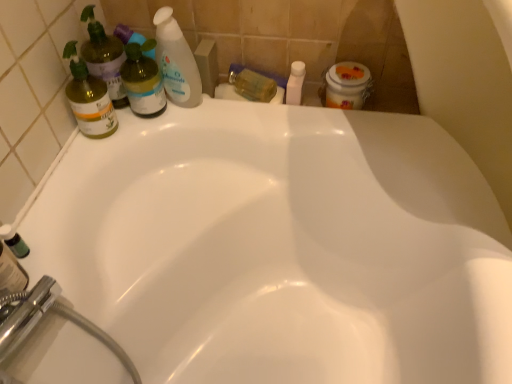
Where is `white plastic bottle at upper center, the second toiletry in the left-to-right sequence`? The width and height of the screenshot is (512, 384). white plastic bottle at upper center, the second toiletry in the left-to-right sequence is located at coordinates (295, 83).

How much space does white plastic bottle at upper center, acting as the 1th toiletry starting from the right, occupy vertically?

6.45 centimeters.

The image size is (512, 384). Identify the location of translucent yellow bottle at upper center, the second toiletry from the right. (252, 84).

Find the location of a particular element. matte green bottle at left, the 2th cleaning product from the left is located at coordinates (104, 57).

Based on the photo, is white plastic bottle at upper center, acting as the 1th toiletry starting from the right, not close to translucent yellow bottle at upper center, which appears as the first toiletry when viewed from the left?

white plastic bottle at upper center, acting as the 1th toiletry starting from the right, is near translucent yellow bottle at upper center, which appears as the first toiletry when viewed from the left, not far away.

Does point (291, 65) appear closer or farther from the camera than point (239, 68)?

Point (291, 65) is positioned closer to the camera compared to point (239, 68).

The width and height of the screenshot is (512, 384). What are the coordinates of `toiletry below the translucent yellow bottle at upper center, which appears as the first toiletry when viewed from the left (from the image's perspective)` in the screenshot? It's located at (295, 83).

Consider the image. Can you confirm if white plastic bottle at upper center, acting as the 1th toiletry starting from the right, is bigger than translucent yellow bottle at upper center, which appears as the first toiletry when viewed from the left?

Incorrect, white plastic bottle at upper center, acting as the 1th toiletry starting from the right, is not larger than translucent yellow bottle at upper center, which appears as the first toiletry when viewed from the left.

Consider the image. Is green matte bottle at lower left positioned with its back to matte green bottle at left, the 2th cleaning product from the left?

No, green matte bottle at lower left's orientation is not away from matte green bottle at left, the 2th cleaning product from the left.

Based on the photo, is green matte bottle at lower left wider or thinner than matte green bottle at left, which is counted as the 2th cleaning product, starting from the right?

Considering their sizes, green matte bottle at lower left looks slimmer than matte green bottle at left, which is counted as the 2th cleaning product, starting from the right.

Image resolution: width=512 pixels, height=384 pixels. I want to click on mouthwash below the matte green bottle at left, which is counted as the 2th cleaning product, starting from the right (from a real-world perspective), so click(x=14, y=241).

Who is shorter, green matte bottle at lower left or matte green bottle at left, which is counted as the 2th cleaning product, starting from the right?

Standing shorter between the two is green matte bottle at lower left.

Could translucent plastic bottle at upper left, placed as the third cleaning product when sorted from left to right, be considered to be inside translucent yellow bottle at upper center, which appears as the first toiletry when viewed from the left?

No, translucent plastic bottle at upper left, placed as the third cleaning product when sorted from left to right, is located outside of translucent yellow bottle at upper center, which appears as the first toiletry when viewed from the left.

Between translucent yellow bottle at upper center, which appears as the first toiletry when viewed from the left, and translucent plastic bottle at upper left, placed as the third cleaning product when sorted from left to right, which one has larger size?

With larger size is translucent plastic bottle at upper left, placed as the third cleaning product when sorted from left to right.

Is translucent yellow bottle at upper center, the second toiletry from the right, facing away from translucent plastic bottle at upper left, placed as the third cleaning product when sorted from left to right?

No, translucent yellow bottle at upper center, the second toiletry from the right, is not facing away from translucent plastic bottle at upper left, placed as the third cleaning product when sorted from left to right.

Would you say white plastic bottle at upper center, acting as the 1th toiletry starting from the right, is part of translucent yellow bottle at upper center, which appears as the first toiletry when viewed from the left,'s contents?

Actually, white plastic bottle at upper center, acting as the 1th toiletry starting from the right, is outside translucent yellow bottle at upper center, which appears as the first toiletry when viewed from the left.

From the image's perspective, is translucent yellow bottle at upper center, which appears as the first toiletry when viewed from the left, located above or below white plastic bottle at upper center, the second toiletry in the left-to-right sequence?

Based on their image positions, translucent yellow bottle at upper center, which appears as the first toiletry when viewed from the left, is located above white plastic bottle at upper center, the second toiletry in the left-to-right sequence.

Between translucent yellow bottle at upper center, the second toiletry from the right, and white plastic bottle at upper center, acting as the 1th toiletry starting from the right, which one is positioned in front?

white plastic bottle at upper center, acting as the 1th toiletry starting from the right, is closer to the camera.

Between point (242, 84) and point (292, 102), which one is positioned behind?

The point (242, 84) is more distant.

Locate an element on the screen. The width and height of the screenshot is (512, 384). cleaning product that is the 3rd object located in front of the translucent yellow bottle at upper center, which appears as the first toiletry when viewed from the left is located at coordinates (89, 98).

Could you tell me if translucent yellow bottle at upper center, which appears as the first toiletry when viewed from the left, is facing green glass spray bottle at left, the 3th cleaning product from the right?

No.

Choose the correct answer: Is translucent yellow bottle at upper center, which appears as the first toiletry when viewed from the left, inside green glass spray bottle at left, the first cleaning product positioned from the left, or outside it?

translucent yellow bottle at upper center, which appears as the first toiletry when viewed from the left, is located beyond the bounds of green glass spray bottle at left, the first cleaning product positioned from the left.

Is translucent plastic bottle at upper left, the 1th cleaning product positioned from the right, far away from white plastic bottle at upper center, the second toiletry in the left-to-right sequence?

No, translucent plastic bottle at upper left, the 1th cleaning product positioned from the right, is not far from white plastic bottle at upper center, the second toiletry in the left-to-right sequence.

From a real-world perspective, is translucent plastic bottle at upper left, placed as the third cleaning product when sorted from left to right, beneath white plastic bottle at upper center, acting as the 1th toiletry starting from the right?

No, from a real-world perspective, translucent plastic bottle at upper left, placed as the third cleaning product when sorted from left to right, is not below white plastic bottle at upper center, acting as the 1th toiletry starting from the right.

Does point (174, 39) appear closer or farther from the camera than point (293, 84)?

Point (174, 39) is positioned closer to the camera compared to point (293, 84).

Is white plastic bottle at upper center, acting as the 1th toiletry starting from the right, situated inside green matte bottle at lower left or outside?

white plastic bottle at upper center, acting as the 1th toiletry starting from the right, lies outside green matte bottle at lower left.

Considering the points (304, 63) and (17, 243), which point is in front, point (304, 63) or point (17, 243)?

The point (17, 243) is in front.

Is white plastic bottle at upper center, the second toiletry in the left-to-right sequence, wider than green matte bottle at lower left?

Yes, white plastic bottle at upper center, the second toiletry in the left-to-right sequence, is wider than green matte bottle at lower left.

Who is bigger, white plastic bottle at upper center, the second toiletry in the left-to-right sequence, or green matte bottle at lower left?

With larger size is white plastic bottle at upper center, the second toiletry in the left-to-right sequence.

The image size is (512, 384). In order to click on toiletry above the translucent yellow bottle at upper center, the second toiletry from the right (from a real-world perspective) in this screenshot , I will do `click(295, 83)`.

This screenshot has height=384, width=512. I want to click on mouthwash below the matte green bottle at left, which is counted as the 2th cleaning product, starting from the right (from the image's perspective), so click(14, 241).

Looking at the image, which one is located closer to white plastic bottle at upper center, acting as the 1th toiletry starting from the right, green glass spray bottle at left, the 3th cleaning product from the right, or translucent plastic bottle at upper left, the 1th cleaning product positioned from the right?

translucent plastic bottle at upper left, the 1th cleaning product positioned from the right, lies closer to white plastic bottle at upper center, acting as the 1th toiletry starting from the right, than the other object.

Considering their positions, is green matte bottle at lower left positioned further to translucent yellow bottle at upper center, which appears as the first toiletry when viewed from the left, than white plastic bottle at upper center, the second toiletry in the left-to-right sequence?

Result: The object further to translucent yellow bottle at upper center, which appears as the first toiletry when viewed from the left, is green matte bottle at lower left.

Considering their positions, is white plastic bottle at upper center, the second toiletry in the left-to-right sequence, positioned further to matte green bottle at left, which is counted as the 2th cleaning product, starting from the right, than green glass spray bottle at left, the first cleaning product positioned from the left?

The object further to matte green bottle at left, which is counted as the 2th cleaning product, starting from the right, is white plastic bottle at upper center, the second toiletry in the left-to-right sequence.

From the image, which object appears to be farther from green glass spray bottle at left, the 3th cleaning product from the right, green matte bottle at lower left or matte green bottle at left, the 2th cleaning product from the left?

Among the two, green matte bottle at lower left is located further to green glass spray bottle at left, the 3th cleaning product from the right.

Which object lies further to the anchor point green matte bottle at lower left, green glass spray bottle at left, the 3th cleaning product from the right, or matte green bottle at left, the 2th cleaning product from the left?

The object further to green matte bottle at lower left is matte green bottle at left, the 2th cleaning product from the left.

From the image, which object appears to be nearer to green glass spray bottle at left, the 3th cleaning product from the right, matte green bottle at left, the 2th cleaning product from the left, or green matte bottle at lower left?

matte green bottle at left, the 2th cleaning product from the left, is positioned closer to the anchor green glass spray bottle at left, the 3th cleaning product from the right.

Estimate the real-world distances between objects in this image. Which object is closer to white plastic bottle at upper center, the second toiletry in the left-to-right sequence, matte green bottle at left, the 2th cleaning product from the left, or translucent yellow bottle at upper center, which appears as the first toiletry when viewed from the left?

The object closer to white plastic bottle at upper center, the second toiletry in the left-to-right sequence, is translucent yellow bottle at upper center, which appears as the first toiletry when viewed from the left.

When comparing their distances from translucent yellow bottle at upper center, which appears as the first toiletry when viewed from the left, does green matte bottle at lower left or matte green bottle at left, which is counted as the 2th cleaning product, starting from the right, seem further?

Among the two, green matte bottle at lower left is located further to translucent yellow bottle at upper center, which appears as the first toiletry when viewed from the left.

This screenshot has height=384, width=512. In order to click on toiletry situated between green glass spray bottle at left, the 3th cleaning product from the right, and white plastic bottle at upper center, acting as the 1th toiletry starting from the right, from left to right in this screenshot , I will do `click(252, 84)`.

Image resolution: width=512 pixels, height=384 pixels. What are the coordinates of `toiletry between translucent plastic bottle at upper left, the 1th cleaning product positioned from the right, and white plastic bottle at upper center, the second toiletry in the left-to-right sequence, in the horizontal direction` in the screenshot? It's located at (252, 84).

I want to click on toiletry located between matte green bottle at left, the 2th cleaning product from the left, and white plastic bottle at upper center, the second toiletry in the left-to-right sequence, in the left-right direction, so click(252, 84).

This screenshot has width=512, height=384. What are the coordinates of `cleaning product between green glass spray bottle at left, the 3th cleaning product from the right, and translucent plastic bottle at upper left, the 1th cleaning product positioned from the right` in the screenshot? It's located at (104, 57).